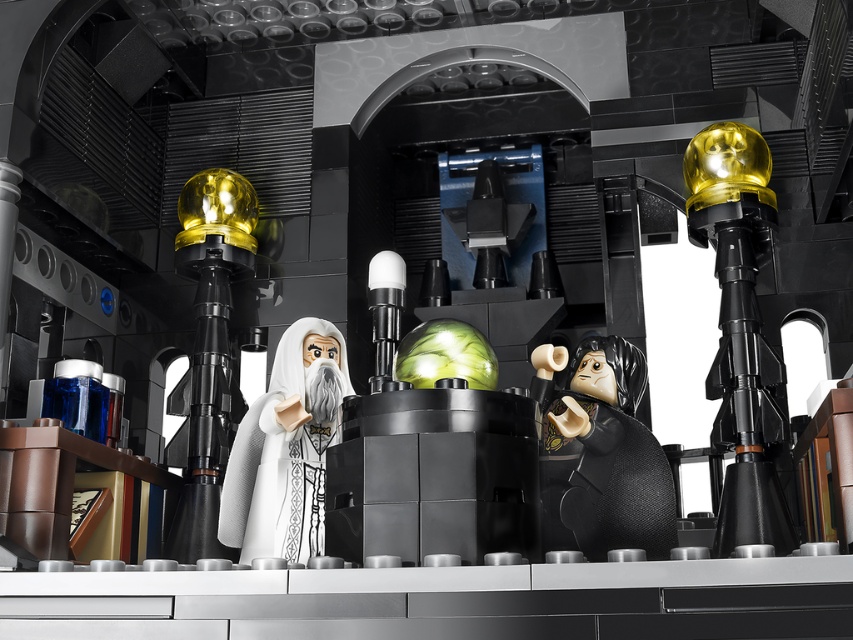
Which is below, gold metallic sphere at left or white matte wizard at center?

white matte wizard at center

Consider the image. Who is higher up, gold metallic sphere at left or white matte wizard at center?

gold metallic sphere at left is higher up.

This screenshot has width=853, height=640. What do you see at coordinates (207, 353) in the screenshot? I see `gold metallic sphere at left` at bounding box center [207, 353].

Where is `gold metallic sphere at left`? Image resolution: width=853 pixels, height=640 pixels. gold metallic sphere at left is located at coordinates (207, 353).

In the scene shown: Can you confirm if gold metallic sphere at right is positioned to the left of black matte figure at center?

In fact, gold metallic sphere at right is to the right of black matte figure at center.

Measure the distance between gold metallic sphere at right and camera.

gold metallic sphere at right and camera are 8.75 feet apart.

What do you see at coordinates (740, 330) in the screenshot? Image resolution: width=853 pixels, height=640 pixels. I see `gold metallic sphere at right` at bounding box center [740, 330].

I want to click on gold metallic sphere at right, so click(x=740, y=330).

Between black matte figure at center and gold metallic sphere at left, which one appears on the left side from the viewer's perspective?

Positioned to the left is gold metallic sphere at left.

Who is more distant from viewer, [660,458] or [228,317]?

The point [228,317] is more distant.

This screenshot has height=640, width=853. In order to click on black matte figure at center in this screenshot , I will do `click(601, 456)`.